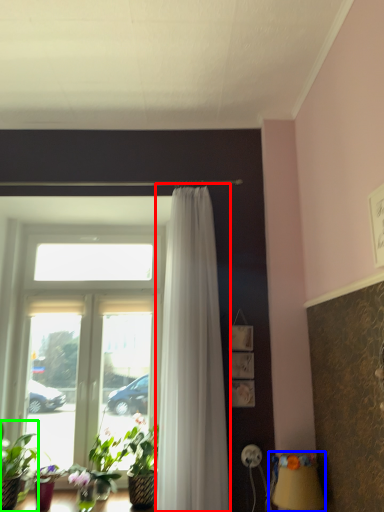
Question: Considering the real-world distances, which object is farthest from curtain (highlighted by a red box)? table lamp (highlighted by a blue box) or houseplant (highlighted by a green box)?

Choices:
 (A) table lamp
 (B) houseplant

Answer: (B)